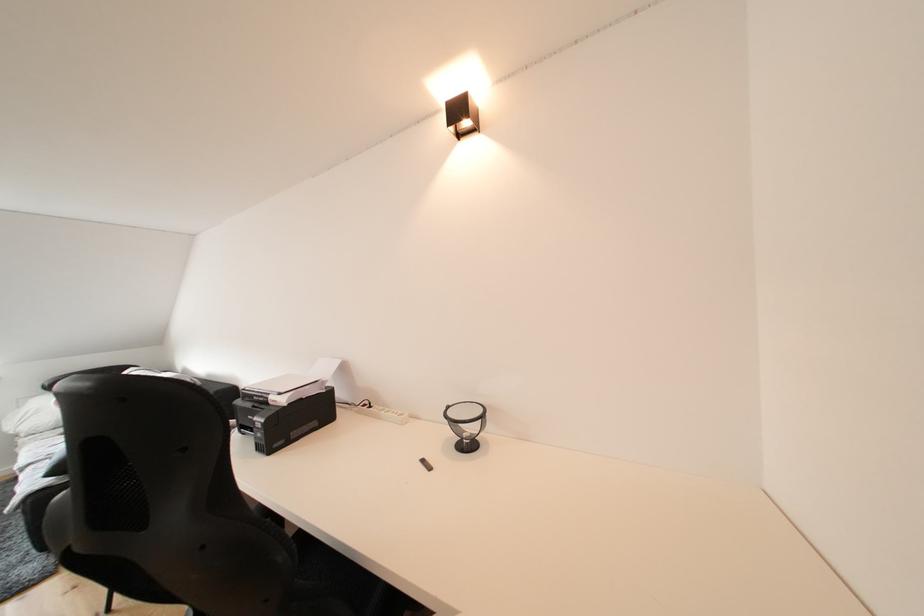
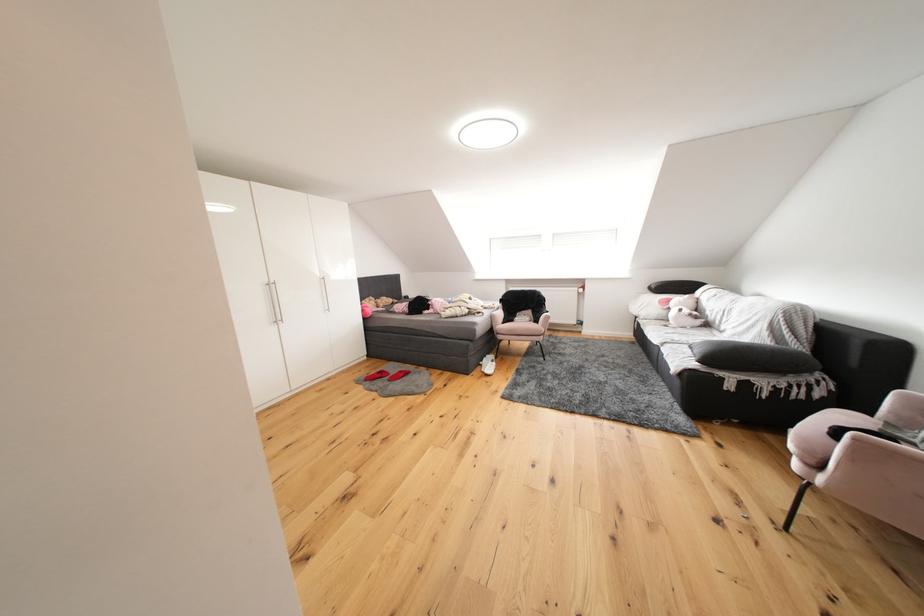
Question: The camera is either moving clockwise (left) or counter-clockwise (right) around the object. The first image is from the beginning of the video and the second image is from the end. Is the camera moving left or right when shooting the video?

Choices:
 (A) Left
 (B) Right

Answer: (B)